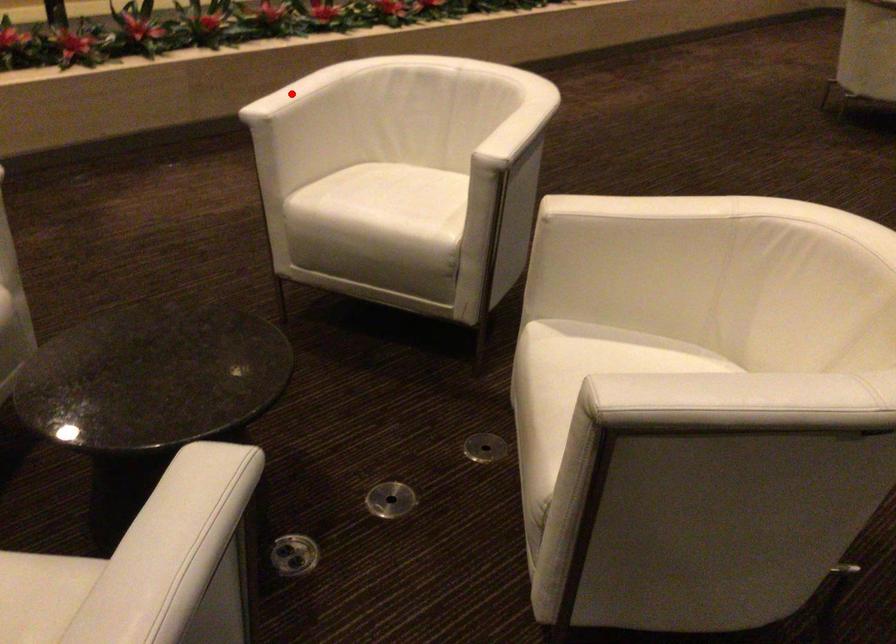
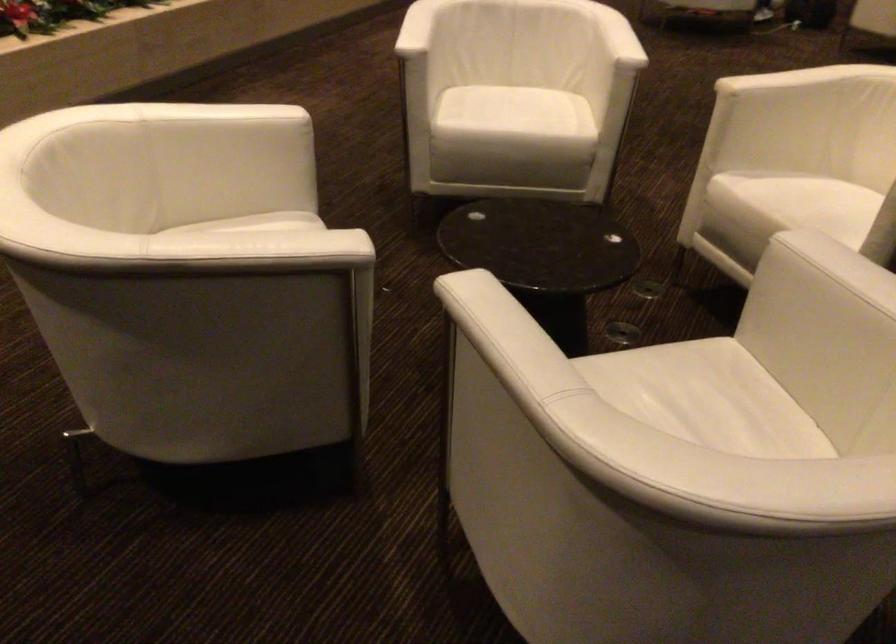
Question: I am providing you with two images of the same scene from different viewpoints. Image1 has a red point marked. In image2, the corresponding 3D location appears at what relative position? Reply with the corresponding letter.

Choices:
 (A) Closer
 (B) Farther

Answer: (B)